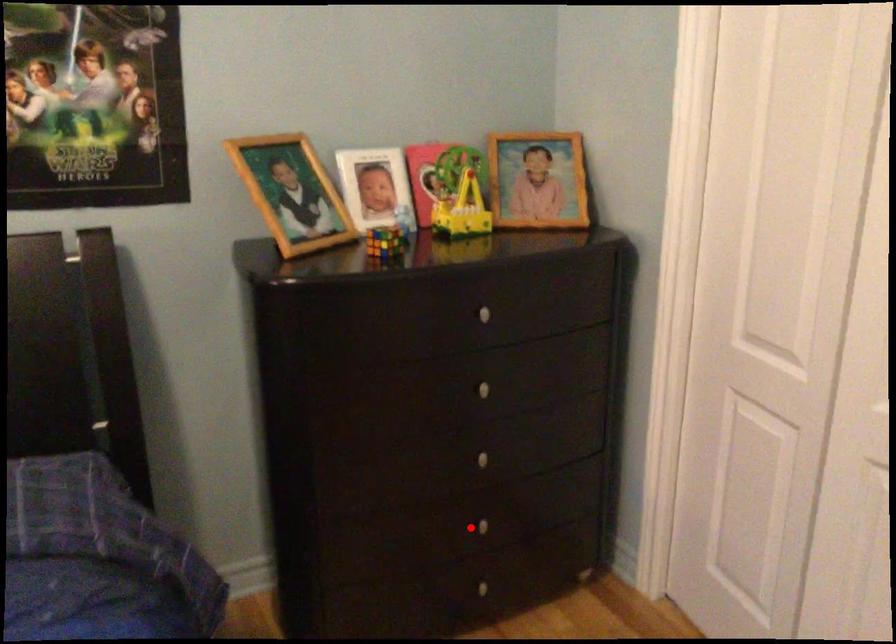
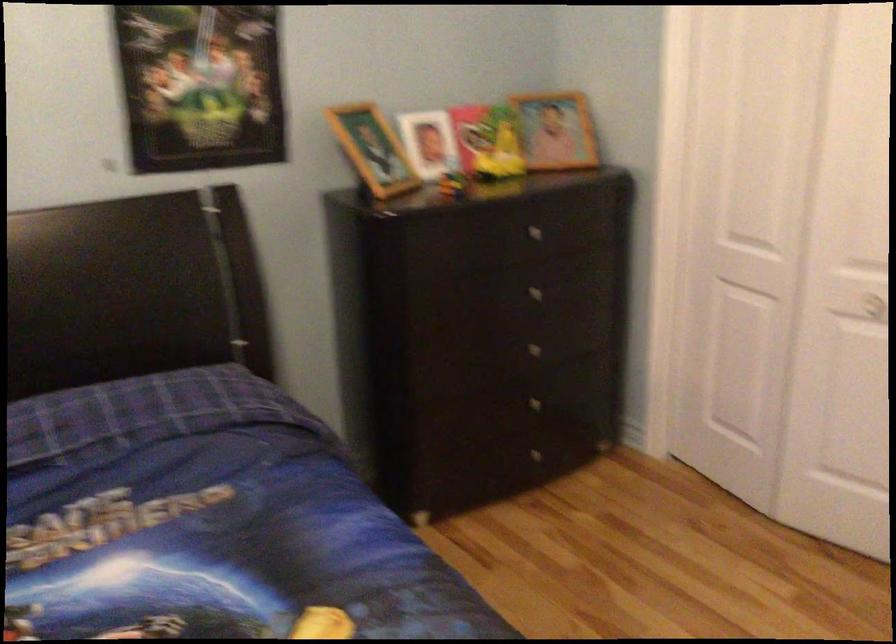
Question: I am providing you with two images of the same scene from different viewpoints. Given a red point in image1, look at the same physical point in image2. Is it:

Choices:
 (A) Closer to the viewpoint
 (B) Farther from the viewpoint

Answer: (B)